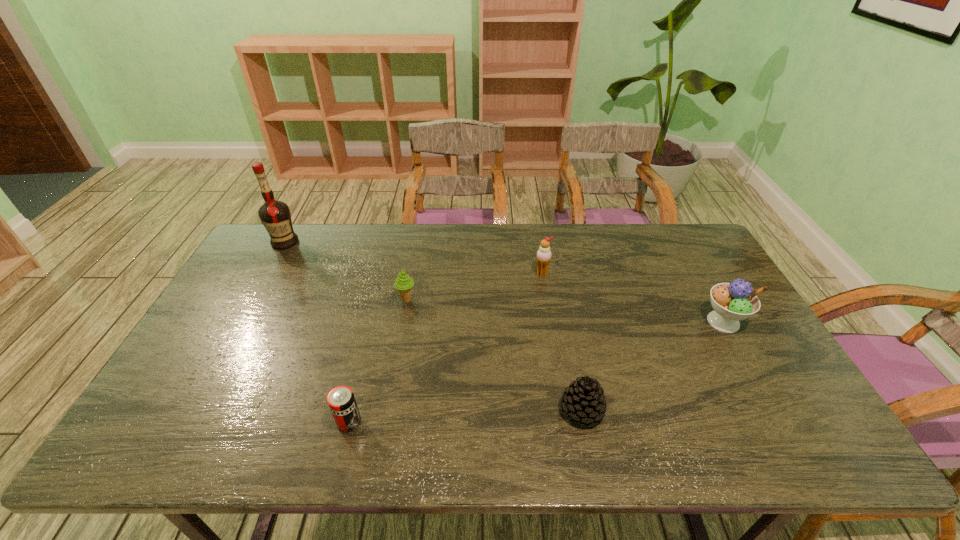
The image size is (960, 540). I want to click on free spot between the leftmost icecream and the second icecream from right to left, so click(x=474, y=286).

Find the location of a particular element. Image resolution: width=960 pixels, height=540 pixels. free spot between the leftmost icecream and the rightmost icecream is located at coordinates (564, 310).

At what (x,y) coordinates should I click in order to perform the action: click on free area in between the second farthest object and the second object from left to right. Please return your answer as a coordinate pair (x, y). Looking at the image, I should click on (445, 347).

The width and height of the screenshot is (960, 540). Find the location of `empty space that is in between the second farthest object and the can`. empty space that is in between the second farthest object and the can is located at coordinates (x=445, y=347).

Where is `free space between the second object from left to right and the leftmost icecream`? This screenshot has width=960, height=540. free space between the second object from left to right and the leftmost icecream is located at coordinates (378, 361).

At what (x,y) coordinates should I click in order to perform the action: click on vacant area that lies between the rightmost object and the farthest icecream. Please return your answer as a coordinate pair (x, y). Looking at the image, I should click on (633, 297).

Identify the location of vacant space in between the liquor and the rightmost icecream. (504, 282).

Locate an element on the screen. The image size is (960, 540). vacant space in between the rightmost object and the pinecone is located at coordinates (653, 366).

Locate which object is the second closest to the rightmost icecream. Please provide its 2D coordinates. Your answer should be formatted as a tuple, i.e. [(x, y)], where the tuple contains the x and y coordinates of a point satisfying the conditions above.

[(543, 256)]

Locate an element on the screen. The image size is (960, 540). object that can be found as the fourth closest to the farthest icecream is located at coordinates (341, 400).